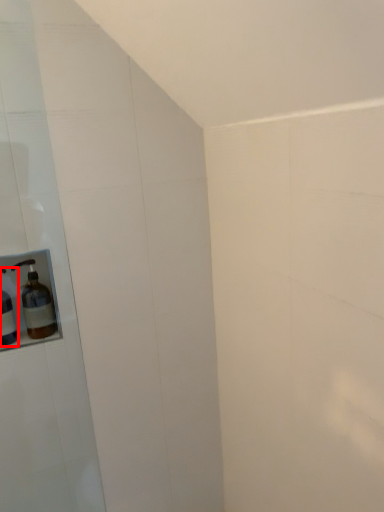
Question: Considering the relative positions of bottle (annotated by the red box) and bottle in the image provided, where is bottle (annotated by the red box) located with respect to the staircase?

Choices:
 (A) right
 (B) left

Answer: (B)